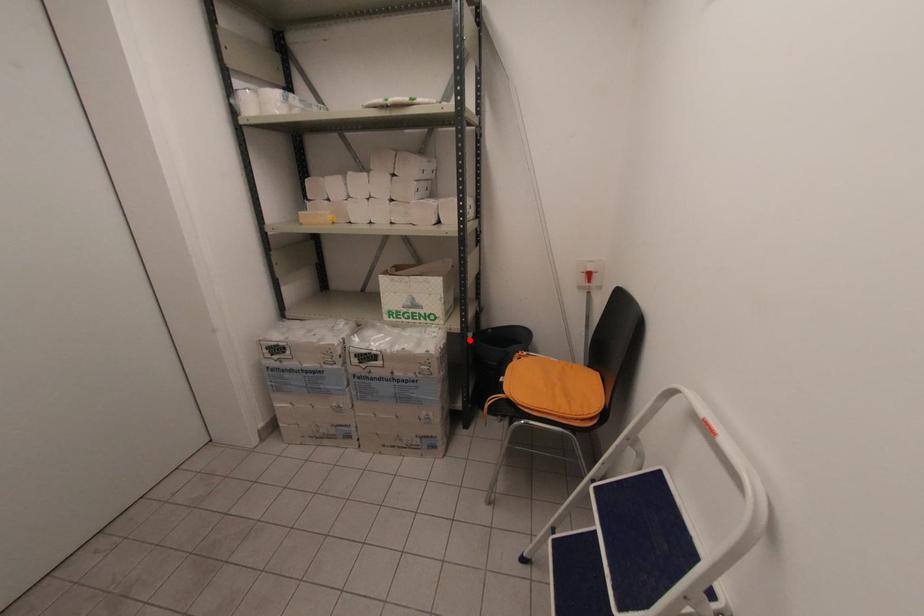
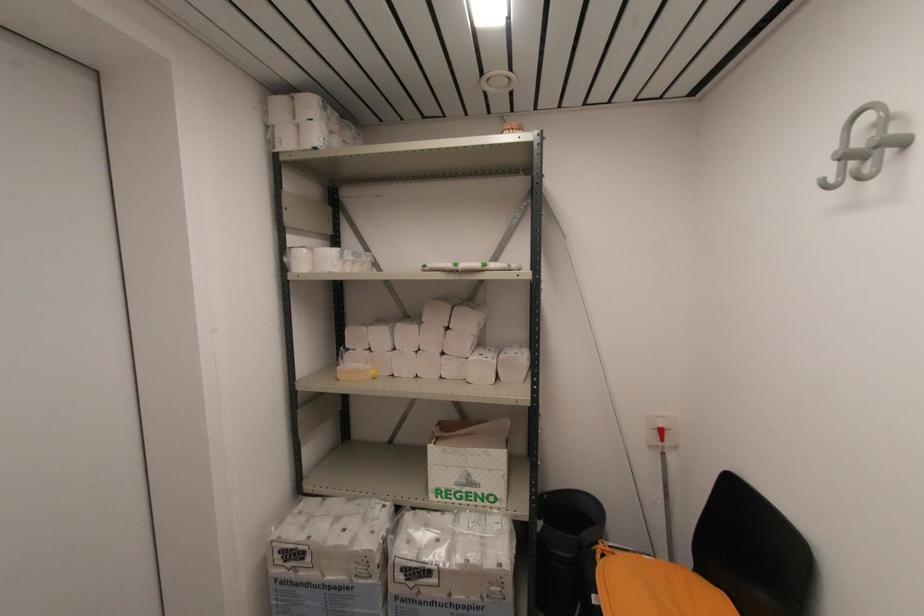
Locate, in the second image, the point that corresponds to the highlighted location in the first image.

(540, 530)